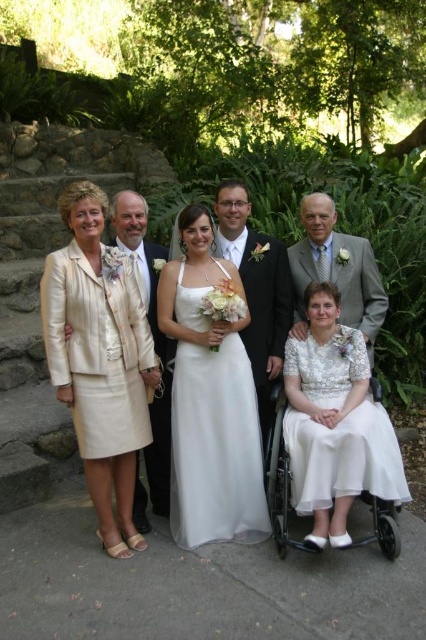
Question: Can you confirm if beige satin suit at left is positioned above light beige fabric suit at left?

Choices:
 (A) no
 (B) yes

Answer: (A)

Question: Which point is closer to the camera?

Choices:
 (A) (264, 332)
 (B) (302, 298)

Answer: (A)

Question: In this image, where is light gray suit at right located relative to light beige fabric suit at left?

Choices:
 (A) above
 (B) below

Answer: (A)

Question: Considering the real-world distances, which object is farthest from the light gray suit at right?

Choices:
 (A) white satin dress at center
 (B) light beige fabric suit at left
 (C) white lace dress at lower center
 (D) shiny black suit at center

Answer: (B)

Question: Is beige satin suit at left wider than shiny black suit at center?

Choices:
 (A) yes
 (B) no

Answer: (A)

Question: Which of the following is the farthest from the observer?

Choices:
 (A) shiny black suit at center
 (B) white lace dress at lower center

Answer: (A)